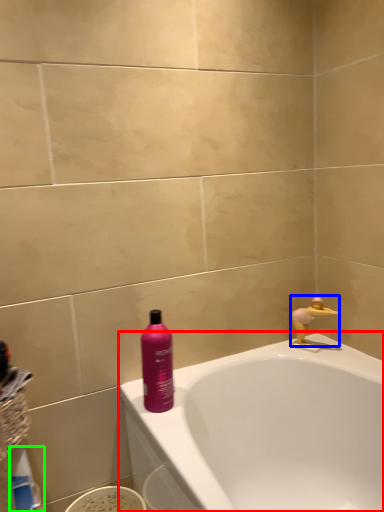
Question: Based on their relative distances, which object is farther from bathtub (highlighted by a red box)? Choose from faucet (highlighted by a blue box) and cleaning product (highlighted by a green box).

Choices:
 (A) faucet
 (B) cleaning product

Answer: (B)